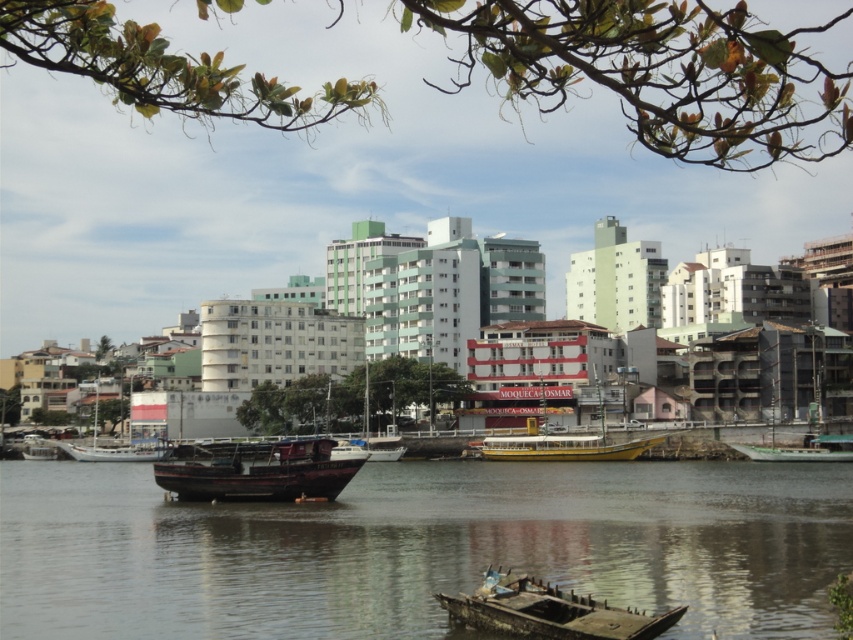
Question: Is rusty metal boat at lower center above wooden boat at center?

Choices:
 (A) no
 (B) yes

Answer: (A)

Question: Does rusty metal boat at lower center have a smaller size compared to yellow matte boat at center?

Choices:
 (A) yes
 (B) no

Answer: (A)

Question: Which of the following is the farthest from the observer?

Choices:
 (A) (305, 440)
 (B) (764, 452)
 (C) (39, 445)
 (D) (96, 452)

Answer: (C)

Question: Is brown wooden boat at lower center thinner than rusty metal boat at lower center?

Choices:
 (A) no
 (B) yes

Answer: (A)

Question: Which is farther from the rusty wood boat at center?

Choices:
 (A) green matte boat at right
 (B) brown wooden boat at lower center
 (C) rusty metal boat at lower center
 (D) wooden boat at lower left

Answer: (D)

Question: Considering the real-world distances, which object is closest to the wooden boat at lower left?

Choices:
 (A) rusty metal boat at lower center
 (B) wooden boat at center
 (C) brown wooden boat at lower center

Answer: (B)